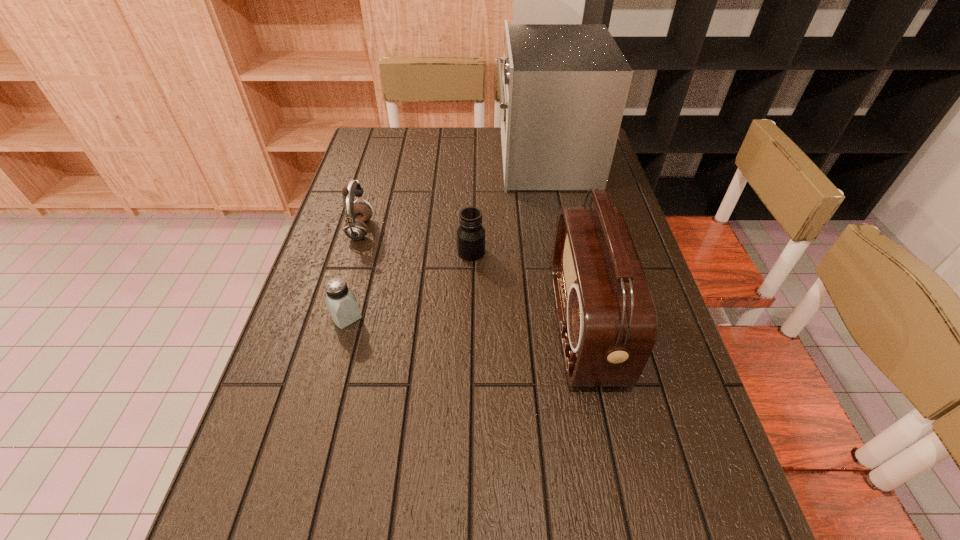
Locate an element on the screen. Image resolution: width=960 pixels, height=540 pixels. vacant point located between the tallest object and the shortest object is located at coordinates (445, 239).

At what (x,y) coordinates should I click in order to perform the action: click on free space between the third shortest object and the tallest object. Please return your answer as a coordinate pair (x, y). Looking at the image, I should click on (453, 195).

The image size is (960, 540). Identify the location of vacant area that lies between the third tallest object and the radio receiver. (472, 279).

Where is `object that is the third nearest to the second tallest object`? The width and height of the screenshot is (960, 540). object that is the third nearest to the second tallest object is located at coordinates (341, 302).

You are a GUI agent. You are given a task and a screenshot of the screen. Output one action in this format:
    pyautogui.click(x=<x>, y=<y>)
    Task: Click on the object that is the third nearest to the saltshaker
    The height and width of the screenshot is (540, 960).
    Given the screenshot: What is the action you would take?
    pyautogui.click(x=607, y=319)

Locate an element on the screen. The image size is (960, 540). vacant space that satisfies the following two spatial constraints: 1. on the ear pads of the third object from right to left; 2. on the right side of the third tallest object is located at coordinates (354, 252).

Image resolution: width=960 pixels, height=540 pixels. What are the coordinates of `vacant space that satisfies the following two spatial constraints: 1. on the ear pads of the earphone; 2. on the left side of the jar` in the screenshot? It's located at (354, 252).

Image resolution: width=960 pixels, height=540 pixels. I want to click on free space that satisfies the following two spatial constraints: 1. on the ear pads of the third shortest object; 2. on the right side of the saltshaker, so click(x=335, y=318).